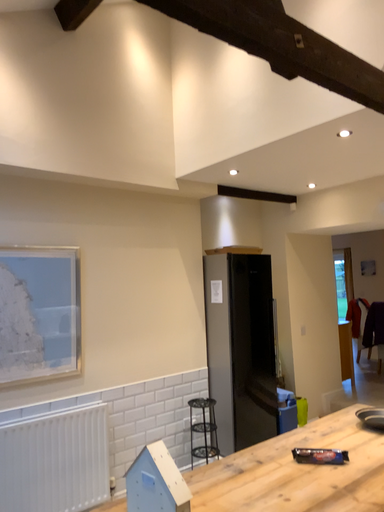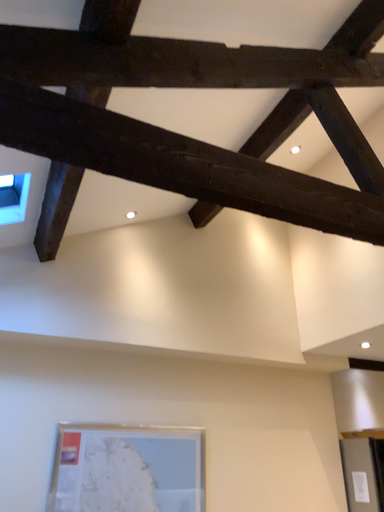
Question: How did the camera likely rotate when shooting the video?

Choices:
 (A) rotated downward
 (B) rotated upward

Answer: (B)